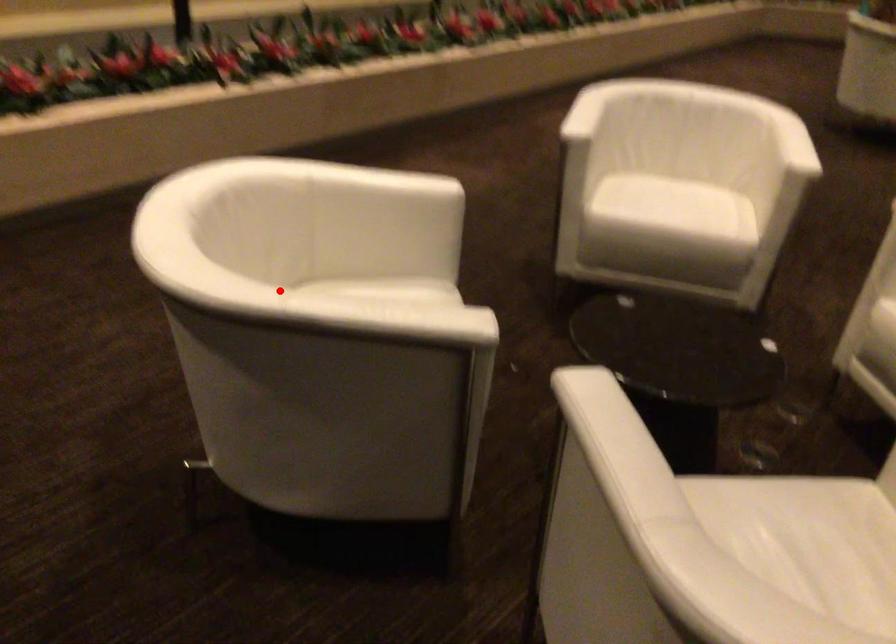
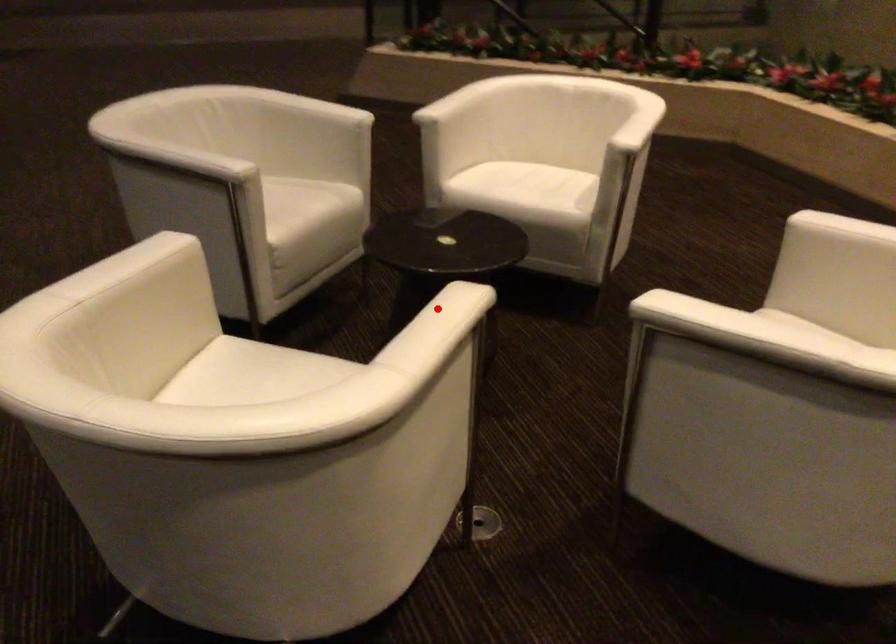
I am providing you with two images of the same scene from different viewpoints. A red point is marked on the first image and another point is marked on the second image. Does the point marked in image1 correspond to the same location as the one in image2?

No